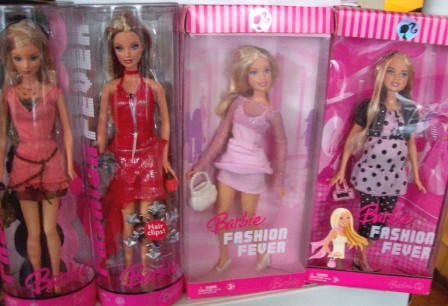
The height and width of the screenshot is (306, 448). Identify the location of red cloth. [x=152, y=129].